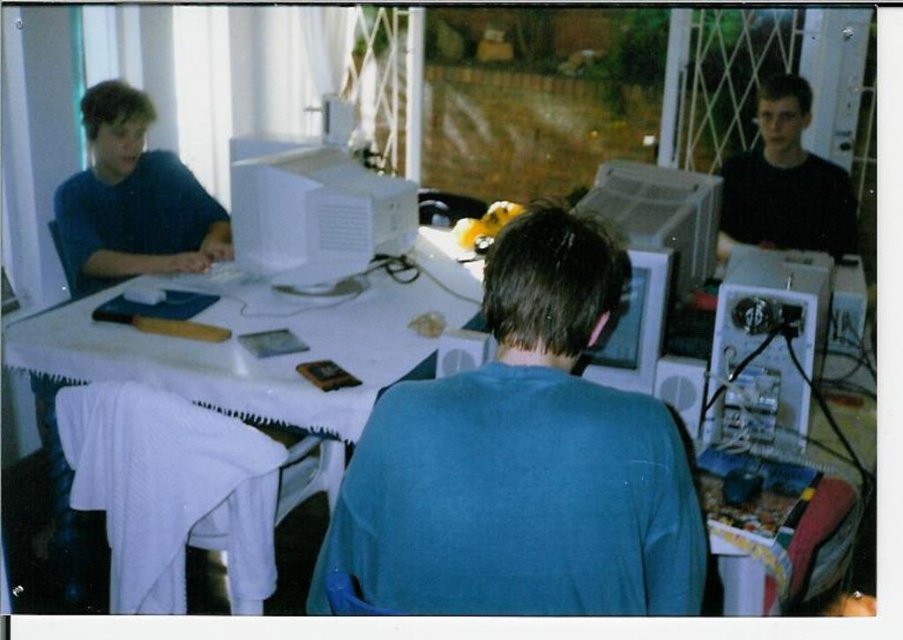
You are a visitor in the room and want to see the metallic silver computer at right without moving the dark blue shirt at left. Is the computer visible from your current position?

The metallic silver computer at right is behind the dark blue shirt at left, so it might not be fully visible unless you move around or the person moves.

You are standing at the point labeled point (x=827, y=284) and want to move to the point labeled point (x=179, y=221). Based on the scene description, is the point you want to reach in front of or behind your current position?

The point labeled point (x=179, y=221) is behind point (x=827, y=284), so it is behind your current position.